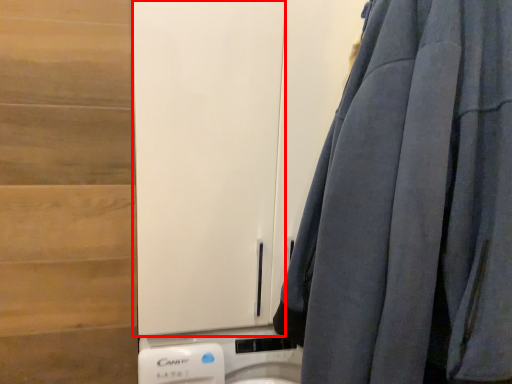
Question: Considering the relative positions of barn door (annotated by the red box) and curtain in the image provided, where is barn door (annotated by the red box) located with respect to the staircase?

Choices:
 (A) right
 (B) left

Answer: (B)